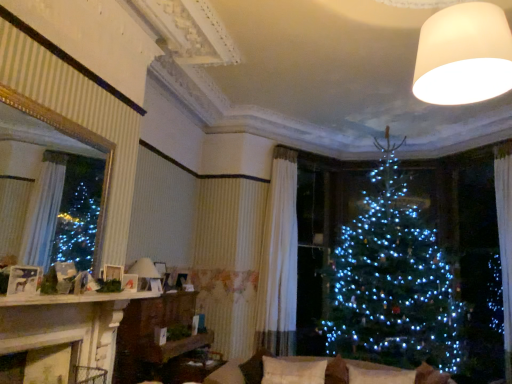
Question: Does white soft pillow at lower center, which appears as the first pillow when viewed from the right, have a greater height compared to matte white lampshade at center, the first lamp viewed from the left?

Choices:
 (A) yes
 (B) no

Answer: (B)

Question: Is white soft pillow at lower center, acting as the 2th pillow starting from the left, shorter than matte white lampshade at center, the 2th lamp in the right-to-left sequence?

Choices:
 (A) yes
 (B) no

Answer: (A)

Question: From the image's perspective, does white soft pillow at lower center, which appears as the first pillow when viewed from the right, appear higher than matte white lampshade at center, which is the 2th lamp in top-to-bottom order?

Choices:
 (A) no
 (B) yes

Answer: (A)

Question: Is white soft pillow at lower center, acting as the 2th pillow starting from the left, positioned beyond the bounds of matte white lampshade at center, which is the 2th lamp in top-to-bottom order?

Choices:
 (A) no
 (B) yes

Answer: (B)

Question: From a real-world perspective, is white soft pillow at lower center, which appears as the first pillow when viewed from the right, below matte white lampshade at center, which is the 2th lamp in top-to-bottom order?

Choices:
 (A) no
 (B) yes

Answer: (B)

Question: Would you say matte white lampshade at center, the 2th lamp in the right-to-left sequence, is part of white soft pillow at lower center, acting as the 2th pillow starting from the left,'s contents?

Choices:
 (A) yes
 (B) no

Answer: (B)

Question: Does beige fabric couch at lower center turn towards matte white picture frame at left, acting as the second picture frame starting from the back?

Choices:
 (A) yes
 (B) no

Answer: (B)

Question: Does beige fabric couch at lower center have a greater width compared to matte white picture frame at left, the 2th picture frame positioned from the bottom?

Choices:
 (A) yes
 (B) no

Answer: (A)

Question: Is beige fabric couch at lower center bigger than matte white picture frame at left, the 2th picture frame positioned from the bottom?

Choices:
 (A) yes
 (B) no

Answer: (A)

Question: Is matte white picture frame at left, the first picture frame in the top-to-bottom sequence, at the back of beige fabric couch at lower center?

Choices:
 (A) no
 (B) yes

Answer: (A)

Question: Is beige fabric couch at lower center far away from matte white picture frame at left, the 2th picture frame positioned from the bottom?

Choices:
 (A) no
 (B) yes

Answer: (B)

Question: Does beige fabric couch at lower center have a lesser width compared to matte white picture frame at left, the first picture frame in the top-to-bottom sequence?

Choices:
 (A) yes
 (B) no

Answer: (B)

Question: From the image's perspective, is white soft cushion at center, marked as the 1th pillow in a left-to-right arrangement, above beige fabric couch at lower center?

Choices:
 (A) no
 (B) yes

Answer: (A)